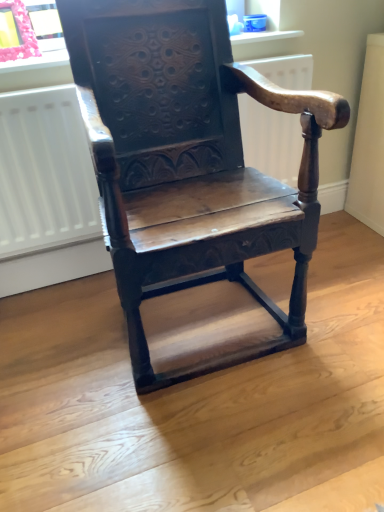
Question: Considering the relative positions of wooden carved chair at center and pink fabric at upper left in the image provided, is wooden carved chair at center to the right of pink fabric at upper left from the viewer's perspective?

Choices:
 (A) no
 (B) yes

Answer: (B)

Question: Are wooden carved chair at center and pink fabric at upper left located far from each other?

Choices:
 (A) yes
 (B) no

Answer: (B)

Question: Considering the relative sizes of wooden carved chair at center and pink fabric at upper left in the image provided, is wooden carved chair at center smaller than pink fabric at upper left?

Choices:
 (A) no
 (B) yes

Answer: (A)

Question: Is wooden carved chair at center to the left of pink fabric at upper left from the viewer's perspective?

Choices:
 (A) yes
 (B) no

Answer: (B)

Question: Considering the relative sizes of wooden carved chair at center and pink fabric at upper left in the image provided, is wooden carved chair at center thinner than pink fabric at upper left?

Choices:
 (A) no
 (B) yes

Answer: (A)

Question: Is the depth of wooden carved chair at center greater than that of pink fabric at upper left?

Choices:
 (A) no
 (B) yes

Answer: (A)

Question: Would you say matte plastic window sill at upper center is a long distance from wooden carved chair at center?

Choices:
 (A) yes
 (B) no

Answer: (B)

Question: Would you say matte plastic window sill at upper center is outside wooden carved chair at center?

Choices:
 (A) no
 (B) yes

Answer: (B)

Question: Is matte plastic window sill at upper center shorter than wooden carved chair at center?

Choices:
 (A) no
 (B) yes

Answer: (B)

Question: Does matte plastic window sill at upper center have a greater width compared to wooden carved chair at center?

Choices:
 (A) no
 (B) yes

Answer: (A)

Question: Does matte plastic window sill at upper center have a smaller size compared to wooden carved chair at center?

Choices:
 (A) no
 (B) yes

Answer: (B)

Question: From a real-world perspective, is matte plastic window sill at upper center physically below wooden carved chair at center?

Choices:
 (A) yes
 (B) no

Answer: (B)

Question: Considering the relative sizes of white matte radiator at center and pink fabric at upper left in the image provided, is white matte radiator at center wider than pink fabric at upper left?

Choices:
 (A) no
 (B) yes

Answer: (A)